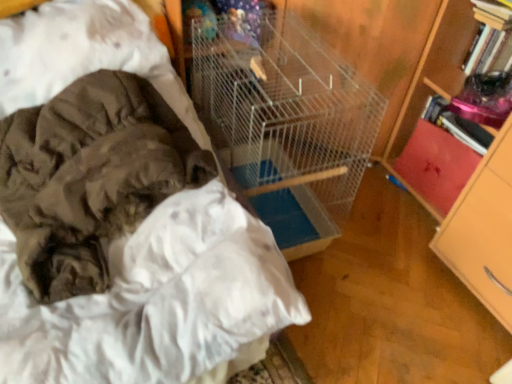
Question: From their relative heights in the image, would you say wooden bookcase at right is taller or shorter than wooden drawer at right, the 1th drawer from the front?

Choices:
 (A) short
 (B) tall

Answer: (B)

Question: From the image's perspective, is wooden bookcase at right positioned above or below wooden drawer at right, the 2th drawer from the back?

Choices:
 (A) above
 (B) below

Answer: (A)

Question: Estimate the real-world distances between objects in this image. Which object is closer to the white wire birdcage at center?

Choices:
 (A) camouflage fabric blanket at left
 (B) wooden bookcase at right
 (C) red leather book at right, which appears as the second drawer when viewed from the front
 (D) wooden drawer at right, the 2th drawer from the back

Answer: (A)

Question: Which object is the closest to the wooden bookcase at right?

Choices:
 (A) wooden drawer at right, the 1th drawer from the front
 (B) camouflage fabric blanket at left
 (C) white wire birdcage at center
 (D) red leather book at right, placed as the 1th drawer when sorted from back to front

Answer: (A)